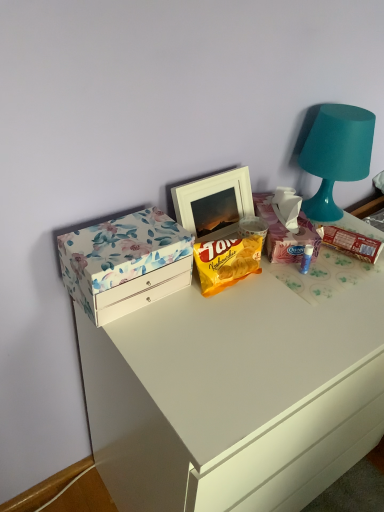
Image resolution: width=384 pixels, height=512 pixels. What are the coordinates of `free space in front of floral paper box at left` in the screenshot? It's located at pyautogui.click(x=159, y=347).